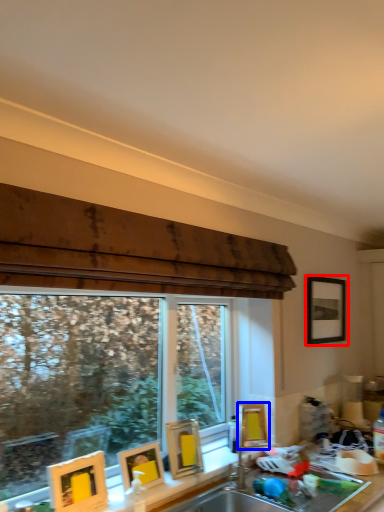
Question: Which of the following is the farthest to the observer, picture frame (highlighted by a red box) or picture frame (highlighted by a blue box)?

Choices:
 (A) picture frame
 (B) picture frame

Answer: (A)